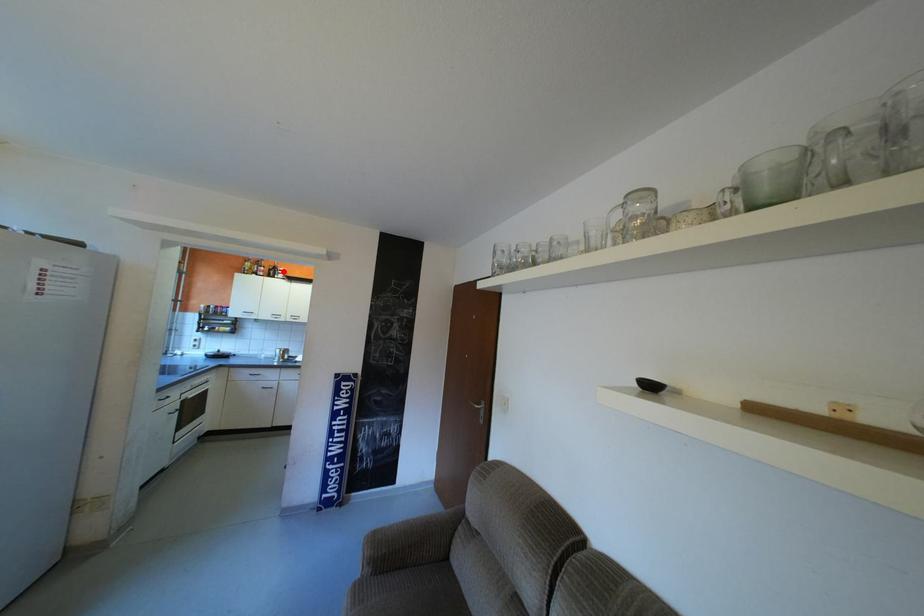
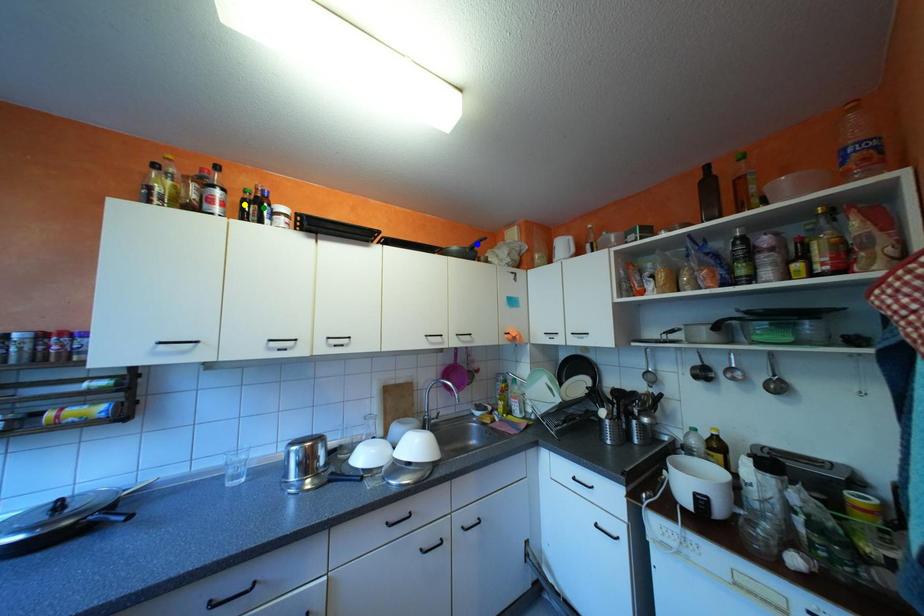
Question: I am providing you with two images of the same scene from different viewpoints. A red point is marked on the first image. You are given multiple points on the second image. Which point in image 2 represents the same 3d spot as the red point in image 1?

Choices:
 (A) yellow point
 (B) green point
 (C) blue point

Answer: (B)